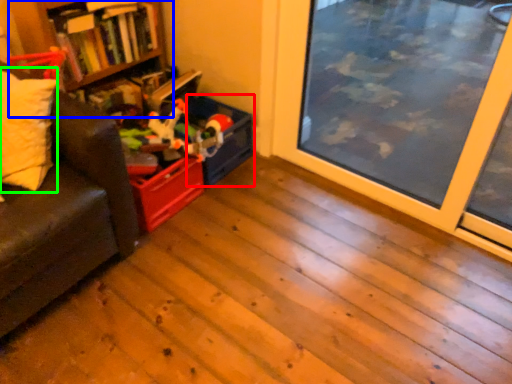
Question: Which is nearer to the storage box (highlighted by a red box)? bookshelf (highlighted by a blue box) or pillow (highlighted by a green box).

Choices:
 (A) bookshelf
 (B) pillow

Answer: (A)